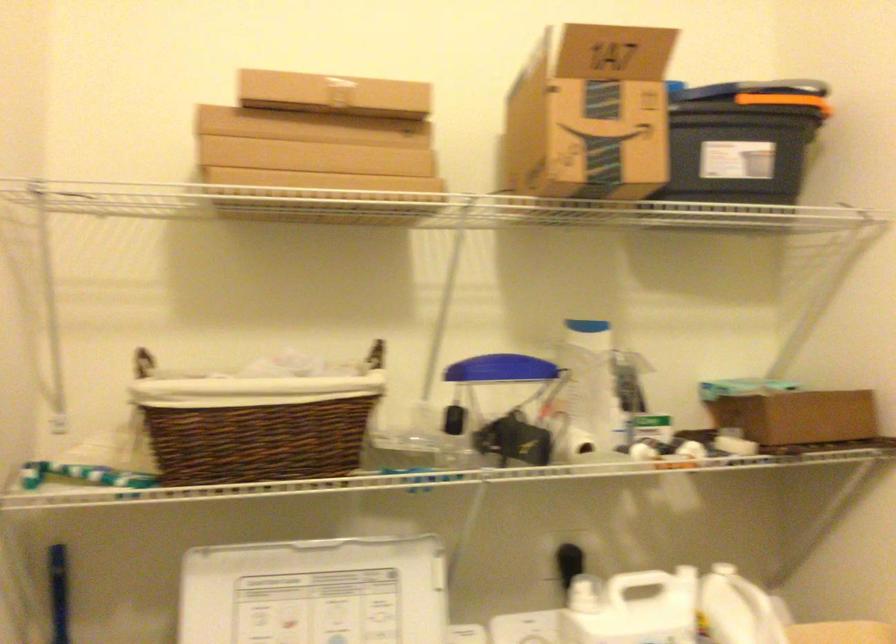
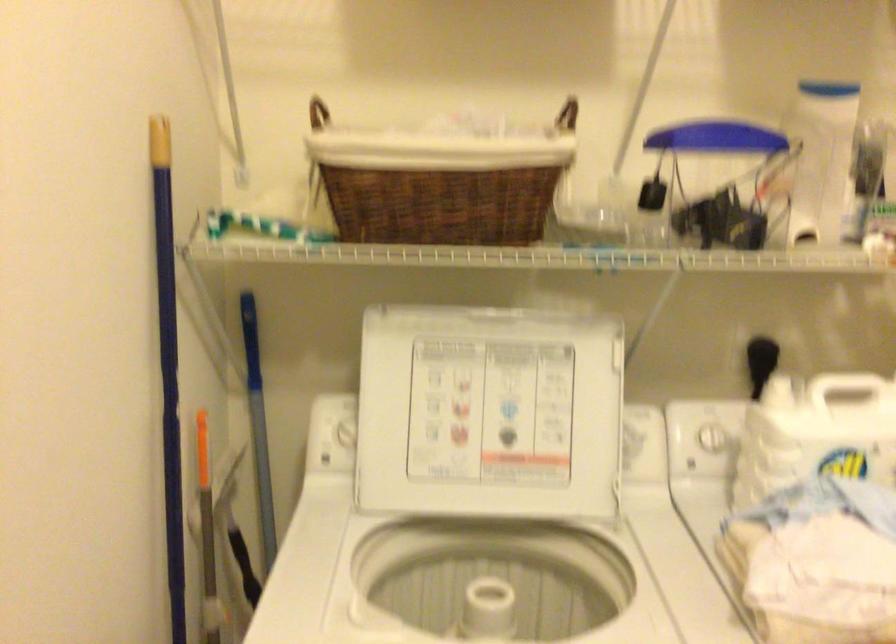
In the second image, find the point that corresponds to [140,363] in the first image.

(317, 113)